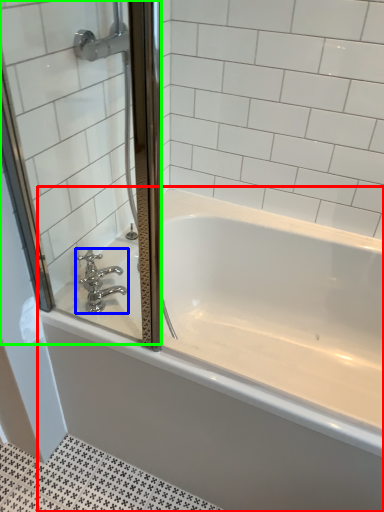
Question: Which is nearer to the bathtub (highlighted by a red box)? tap (highlighted by a blue box) or screen door (highlighted by a green box).

Choices:
 (A) tap
 (B) screen door

Answer: (B)